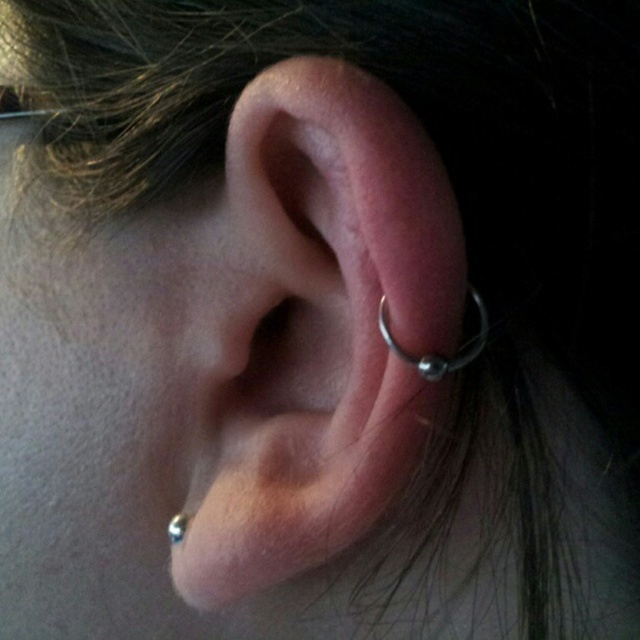
Question: Is silver metallic hoop at center positioned at the back of silver metallic ring at ear?

Choices:
 (A) yes
 (B) no

Answer: (B)

Question: Which point is farther from the camera taking this photo?

Choices:
 (A) (225, 401)
 (B) (176, 515)

Answer: (B)

Question: Is silver metallic hoop at center wider than silver metallic ring at ear?

Choices:
 (A) yes
 (B) no

Answer: (A)

Question: Can you confirm if silver metallic hoop at center is wider than silver metallic ring at ear?

Choices:
 (A) no
 (B) yes

Answer: (B)